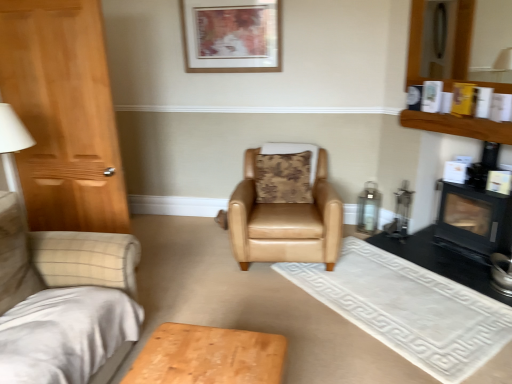
Question: Is tan leather armchair at center at the right side of camouflage fabric pillow at center?

Choices:
 (A) yes
 (B) no

Answer: (B)

Question: Can you confirm if tan leather armchair at center is wider than camouflage fabric pillow at center?

Choices:
 (A) yes
 (B) no

Answer: (A)

Question: Would you say tan leather armchair at center contains camouflage fabric pillow at center?

Choices:
 (A) yes
 (B) no

Answer: (A)

Question: Is the position of tan leather armchair at center more distant than that of camouflage fabric pillow at center?

Choices:
 (A) yes
 (B) no

Answer: (B)

Question: Is tan leather armchair at center outside camouflage fabric pillow at center?

Choices:
 (A) no
 (B) yes

Answer: (B)

Question: From the image's perspective, is tan leather armchair at center above camouflage fabric pillow at center?

Choices:
 (A) no
 (B) yes

Answer: (A)

Question: Considering the relative positions of camouflage fabric pillow at center and wooden shelf at upper right in the image provided, is camouflage fabric pillow at center to the left of wooden shelf at upper right from the viewer's perspective?

Choices:
 (A) no
 (B) yes

Answer: (B)

Question: Is camouflage fabric pillow at center thinner than wooden shelf at upper right?

Choices:
 (A) no
 (B) yes

Answer: (A)

Question: Is camouflage fabric pillow at center beside wooden shelf at upper right?

Choices:
 (A) no
 (B) yes

Answer: (A)

Question: Is camouflage fabric pillow at center not near wooden shelf at upper right?

Choices:
 (A) no
 (B) yes

Answer: (B)

Question: Considering the relative sizes of camouflage fabric pillow at center and wooden shelf at upper right in the image provided, is camouflage fabric pillow at center taller than wooden shelf at upper right?

Choices:
 (A) no
 (B) yes

Answer: (B)

Question: Is camouflage fabric pillow at center smaller than wooden shelf at upper right?

Choices:
 (A) yes
 (B) no

Answer: (B)

Question: From the image's perspective, is tan leather armchair at center over black matte fireplace at right?

Choices:
 (A) no
 (B) yes

Answer: (A)